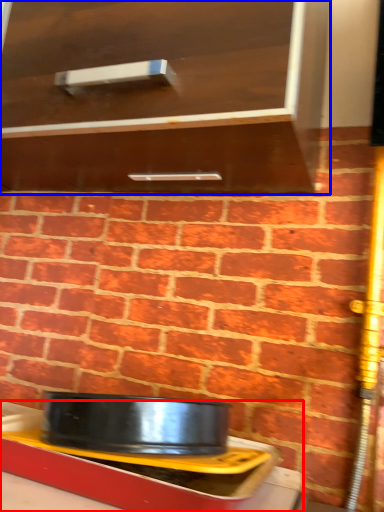
Question: Which of the following is the closest to the observer, table (highlighted by a red box) or cabinetry (highlighted by a blue box)?

Choices:
 (A) table
 (B) cabinetry

Answer: (B)